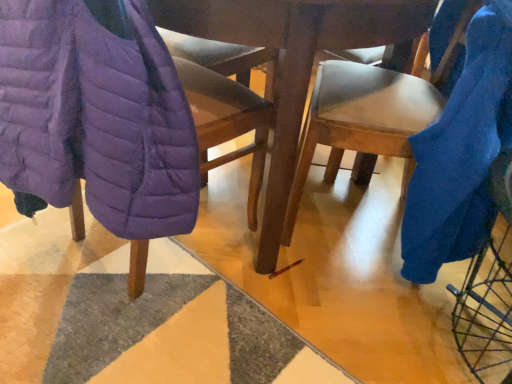
Question: Is blue fuzzy blanket at right, the first blanket positioned from the right, located outside purple quilted jacket at left, positioned as the first blanket in left-to-right order?

Choices:
 (A) no
 (B) yes

Answer: (B)

Question: From the image's perspective, is blue fuzzy blanket at right, the first blanket positioned from the right, below purple quilted jacket at left, which is the 2th blanket in right-to-left order?

Choices:
 (A) no
 (B) yes

Answer: (B)

Question: Is blue fuzzy blanket at right, the first blanket positioned from the right, positioned in front of purple quilted jacket at left, which is the 2th blanket in right-to-left order?

Choices:
 (A) no
 (B) yes

Answer: (A)

Question: Does blue fuzzy blanket at right, which is the 2th blanket from left to right, have a lesser width compared to purple quilted jacket at left, positioned as the first blanket in left-to-right order?

Choices:
 (A) no
 (B) yes

Answer: (A)

Question: Is blue fuzzy blanket at right, which is the 2th blanket from left to right, not near purple quilted jacket at left, positioned as the first blanket in left-to-right order?

Choices:
 (A) yes
 (B) no

Answer: (B)

Question: From the image's perspective, is blue fuzzy blanket at right, the first blanket positioned from the right, on top of purple quilted jacket at left, positioned as the first blanket in left-to-right order?

Choices:
 (A) no
 (B) yes

Answer: (A)

Question: From a real-world perspective, is purple quilted jacket at left, which ranks as the second chair in right-to-left order, beneath blue fuzzy blanket at right, which is the 2th blanket from left to right?

Choices:
 (A) no
 (B) yes

Answer: (B)

Question: Is purple quilted jacket at left, which ranks as the second chair in right-to-left order, aimed at blue fuzzy blanket at right, which is the 2th blanket from left to right?

Choices:
 (A) no
 (B) yes

Answer: (A)

Question: Is purple quilted jacket at left, which ranks as the second chair in right-to-left order, to the left of blue fuzzy blanket at right, the first blanket positioned from the right, from the viewer's perspective?

Choices:
 (A) no
 (B) yes

Answer: (B)

Question: Is blue fuzzy blanket at right, the first blanket positioned from the right, inside purple quilted jacket at left, which ranks as the second chair in right-to-left order?

Choices:
 (A) no
 (B) yes

Answer: (A)

Question: Does purple quilted jacket at left, which ranks as the second chair in right-to-left order, come in front of blue fuzzy blanket at right, the first blanket positioned from the right?

Choices:
 (A) no
 (B) yes

Answer: (B)

Question: Is purple quilted jacket at left, which ranks as the second chair in right-to-left order, smaller than blue fuzzy blanket at right, the first blanket positioned from the right?

Choices:
 (A) yes
 (B) no

Answer: (B)

Question: From the image's perspective, does purple quilted jacket at left, which is the 2th blanket in right-to-left order, appear higher than purple quilted jacket at left, which ranks as the second chair in right-to-left order?

Choices:
 (A) no
 (B) yes

Answer: (B)